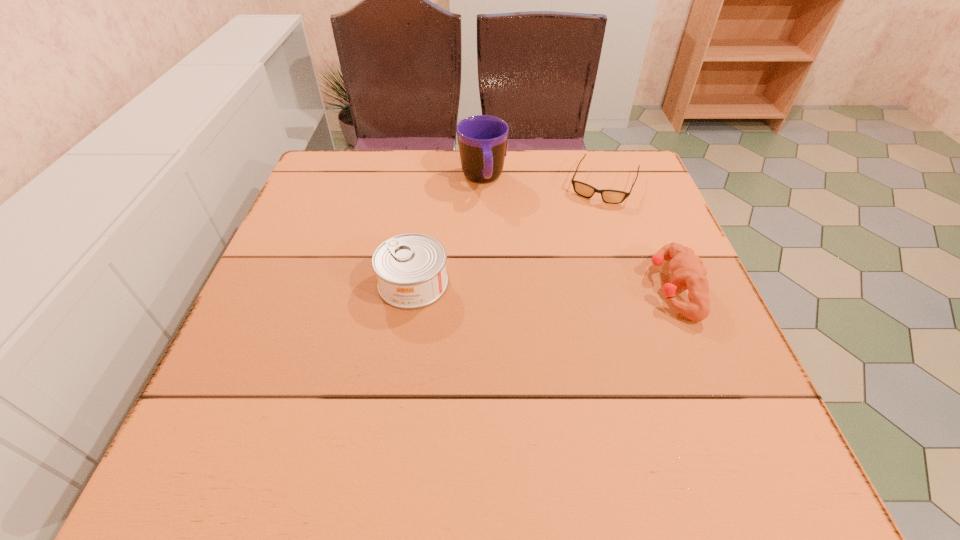
At what (x,y) coordinates should I click in order to perform the action: click on free space between the mug and the shortest object. Please return your answer as a coordinate pair (x, y). This screenshot has height=540, width=960. Looking at the image, I should click on (543, 181).

What are the coordinates of `vacant area between the can and the mug` in the screenshot? It's located at (447, 231).

You are a GUI agent. You are given a task and a screenshot of the screen. Output one action in this format:
    pyautogui.click(x=<x>, y=<y>)
    Task: Click on the free area in between the sunglasses and the third object from right to left
    The height and width of the screenshot is (540, 960).
    Given the screenshot: What is the action you would take?
    [543, 181]

At what (x,y) coordinates should I click in order to perform the action: click on vacant area that lies between the mug and the puncher. Please return your answer as a coordinate pair (x, y). This screenshot has height=540, width=960. Looking at the image, I should click on (578, 234).

You are a GUI agent. You are given a task and a screenshot of the screen. Output one action in this format:
    pyautogui.click(x=<x>, y=<y>)
    Task: Click on the vacant region between the leftmost object and the puncher
    
    Given the screenshot: What is the action you would take?
    pyautogui.click(x=542, y=285)

Locate an element on the screen. free space between the puncher and the shortest object is located at coordinates (638, 235).

This screenshot has height=540, width=960. What are the coordinates of `vacant space that's between the sunglasses and the mug` in the screenshot? It's located at (543, 181).

You are a GUI agent. You are given a task and a screenshot of the screen. Output one action in this format:
    pyautogui.click(x=<x>, y=<y>)
    Task: Click on the free spot between the puncher and the second object from left to right
    This screenshot has height=540, width=960.
    Given the screenshot: What is the action you would take?
    pyautogui.click(x=578, y=234)

Identify which object is the second nearest to the puncher. Please provide its 2D coordinates. Your answer should be formatted as a tuple, i.e. [(x, y)], where the tuple contains the x and y coordinates of a point satisfying the conditions above.

[(482, 139)]

Identify which object is the closest to the can. Please provide its 2D coordinates. Your answer should be formatted as a tuple, i.e. [(x, y)], where the tuple contains the x and y coordinates of a point satisfying the conditions above.

[(482, 139)]